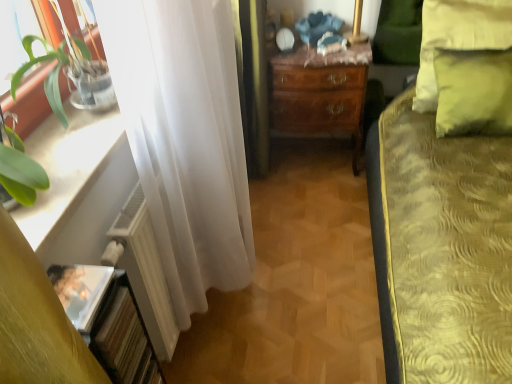
Question: From the image's perspective, is yellow fabric pillow at upper right beneath green leafy plant at left?

Choices:
 (A) yes
 (B) no

Answer: (B)

Question: Is yellow fabric pillow at upper right facing towards green leafy plant at left?

Choices:
 (A) no
 (B) yes

Answer: (A)

Question: Is yellow fabric pillow at upper right outside of green leafy plant at left?

Choices:
 (A) yes
 (B) no

Answer: (A)

Question: Can you confirm if yellow fabric pillow at upper right is taller than green leafy plant at left?

Choices:
 (A) no
 (B) yes

Answer: (B)

Question: Can you confirm if yellow fabric pillow at upper right is shorter than green leafy plant at left?

Choices:
 (A) yes
 (B) no

Answer: (B)

Question: Does yellow fabric pillow at upper right have a smaller size compared to green leafy plant at left?

Choices:
 (A) yes
 (B) no

Answer: (B)

Question: From a real-world perspective, is white glossy window sill at left positioned over yellow fabric pillow at upper right based on gravity?

Choices:
 (A) no
 (B) yes

Answer: (B)

Question: Can you confirm if white glossy window sill at left is bigger than yellow fabric pillow at upper right?

Choices:
 (A) no
 (B) yes

Answer: (A)

Question: Is white glossy window sill at left in front of yellow fabric pillow at upper right?

Choices:
 (A) yes
 (B) no

Answer: (A)

Question: From the image's perspective, is white glossy window sill at left beneath yellow fabric pillow at upper right?

Choices:
 (A) no
 (B) yes

Answer: (B)

Question: Would you say white glossy window sill at left is a long distance from yellow fabric pillow at upper right?

Choices:
 (A) no
 (B) yes

Answer: (B)

Question: Can you confirm if white glossy window sill at left is positioned to the right of yellow fabric pillow at upper right?

Choices:
 (A) no
 (B) yes

Answer: (A)

Question: Considering the relative sizes of white glossy window sill at left and white matte radiator at left in the image provided, is white glossy window sill at left shorter than white matte radiator at left?

Choices:
 (A) no
 (B) yes

Answer: (B)